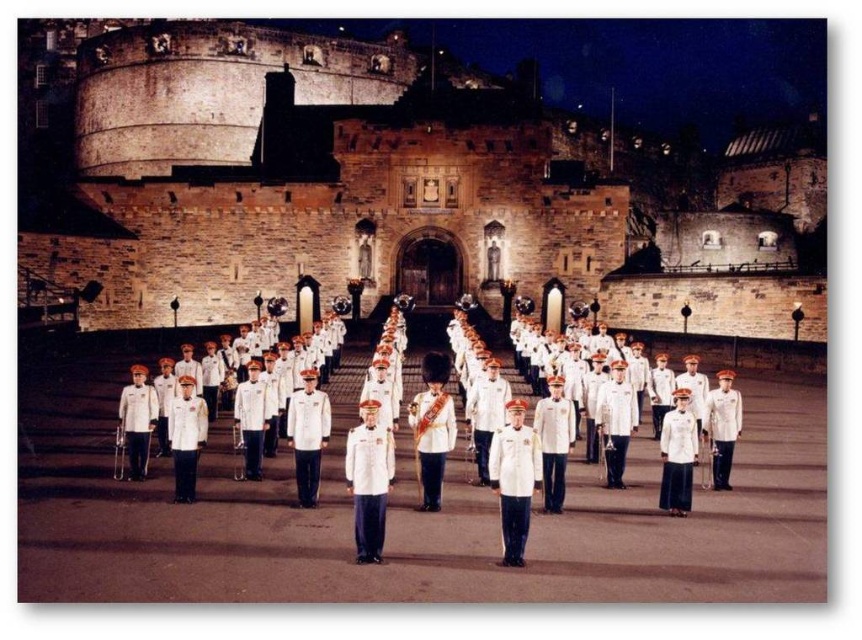
Question: Which point is farther to the camera?

Choices:
 (A) [397, 426]
 (B) [522, 141]

Answer: (B)

Question: Is matte white uniform at center positioned at the back of white uniformed band at center?

Choices:
 (A) yes
 (B) no

Answer: (A)

Question: Can you confirm if matte white uniform at center is thinner than white uniformed band at center?

Choices:
 (A) yes
 (B) no

Answer: (B)

Question: Which object is closer to the camera taking this photo?

Choices:
 (A) matte white uniform at center
 (B) white uniformed band at center

Answer: (B)

Question: Among these points, which one is nearest to the camera?

Choices:
 (A) (663, 330)
 (B) (159, 360)

Answer: (B)

Question: Does matte white uniform at center come behind white uniformed band at center?

Choices:
 (A) no
 (B) yes

Answer: (B)